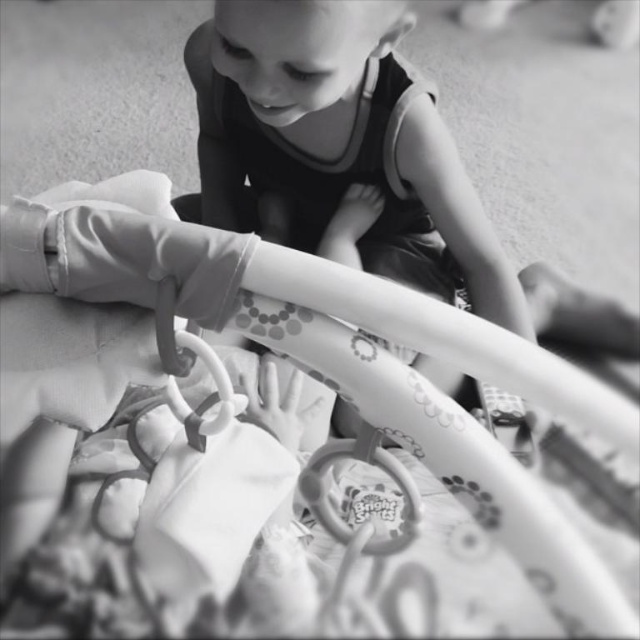
Question: Which point is farther to the camera?

Choices:
 (A) (312, 508)
 (B) (444, 349)

Answer: (A)

Question: Is patterned plastic infant bed at center thinner than rubber teething ring at center?

Choices:
 (A) yes
 (B) no

Answer: (B)

Question: Can you confirm if patterned plastic infant bed at center is positioned to the right of rubber teething ring at center?

Choices:
 (A) no
 (B) yes

Answer: (A)

Question: Which point is farther from the camera taking this photo?

Choices:
 (A) (344, 532)
 (B) (579, 556)

Answer: (A)

Question: From the image, what is the correct spatial relationship of patterned plastic infant bed at center in relation to rubber teething ring at center?

Choices:
 (A) left
 (B) right

Answer: (A)